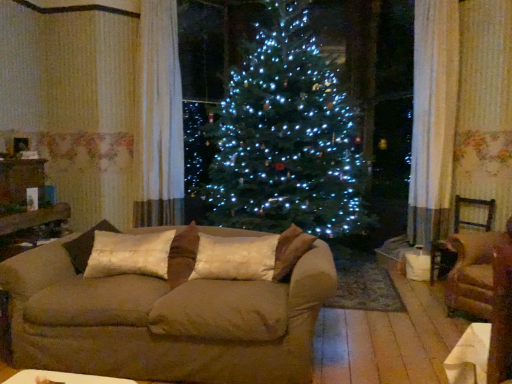
Question: Can you confirm if brown fabric armchair at right, which is counted as the 2th armchair, starting from the back, is thinner than silky beige pillow at center, which is counted as the 1th pillow, starting from the right?

Choices:
 (A) yes
 (B) no

Answer: (B)

Question: Can you confirm if brown fabric armchair at right, which is counted as the 2th armchair, starting from the back, is bigger than silky beige pillow at center, arranged as the 2th pillow when viewed from the left?

Choices:
 (A) yes
 (B) no

Answer: (A)

Question: Would you say silky beige pillow at center, which is counted as the 1th pillow, starting from the right, is part of brown fabric armchair at right, which is counted as the 2th armchair, starting from the back,'s contents?

Choices:
 (A) yes
 (B) no

Answer: (B)

Question: From the image's perspective, is brown fabric armchair at right, which is counted as the 2th armchair, starting from the back, above silky beige pillow at center, arranged as the 2th pillow when viewed from the left?

Choices:
 (A) yes
 (B) no

Answer: (B)

Question: Can you confirm if brown fabric armchair at right, which is the 1th armchair in front-to-back order, is taller than silky beige pillow at center, which is counted as the 1th pillow, starting from the right?

Choices:
 (A) yes
 (B) no

Answer: (A)

Question: From the image's perspective, is brown fabric armchair at right, which is the 1th armchair in front-to-back order, beneath silky beige pillow at center, arranged as the 2th pillow when viewed from the left?

Choices:
 (A) yes
 (B) no

Answer: (A)

Question: Can you confirm if silky beige pillow at center, which is counted as the 1th pillow, starting from the right, is taller than brown fabric armchair at right, which is counted as the 1th armchair, starting from the back?

Choices:
 (A) yes
 (B) no

Answer: (B)

Question: Is silky beige pillow at center, arranged as the 2th pillow when viewed from the left, not close to brown fabric armchair at right, which is counted as the 1th armchair, starting from the back?

Choices:
 (A) no
 (B) yes

Answer: (B)

Question: Is silky beige pillow at center, arranged as the 2th pillow when viewed from the left, smaller than brown fabric armchair at right, which is counted as the 1th armchair, starting from the back?

Choices:
 (A) yes
 (B) no

Answer: (A)

Question: Would you say silky beige pillow at center, arranged as the 2th pillow when viewed from the left, contains brown fabric armchair at right, acting as the 2th armchair starting from the front?

Choices:
 (A) no
 (B) yes

Answer: (A)

Question: Is silky beige pillow at center, which is counted as the 1th pillow, starting from the right, oriented towards brown fabric armchair at right, acting as the 2th armchair starting from the front?

Choices:
 (A) no
 (B) yes

Answer: (A)

Question: Does silky beige pillow at center, which is counted as the 1th pillow, starting from the right, appear on the left side of brown fabric armchair at right, acting as the 2th armchair starting from the front?

Choices:
 (A) yes
 (B) no

Answer: (A)

Question: Is silky beige pillow at center, which is counted as the 1th pillow, starting from the right, facing towards brown fabric armchair at right, which is counted as the 2th armchair, starting from the back?

Choices:
 (A) no
 (B) yes

Answer: (A)